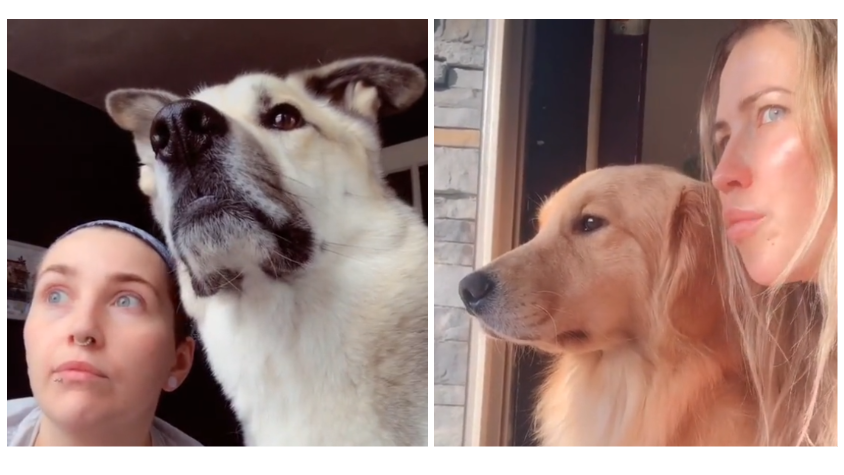
Where is `window`? This screenshot has height=475, width=844. window is located at coordinates (457, 158).